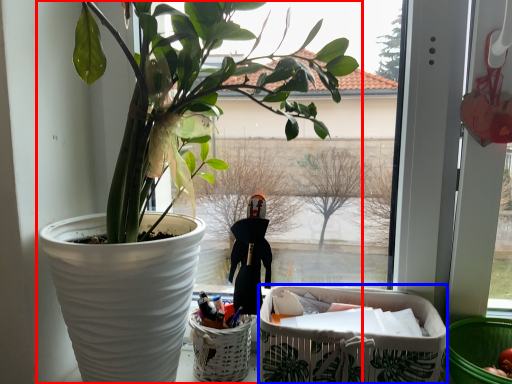
Question: Which object appears farthest to the camera in this image, houseplant (highlighted by a red box) or shopping basket (highlighted by a blue box)?

Choices:
 (A) houseplant
 (B) shopping basket

Answer: (B)